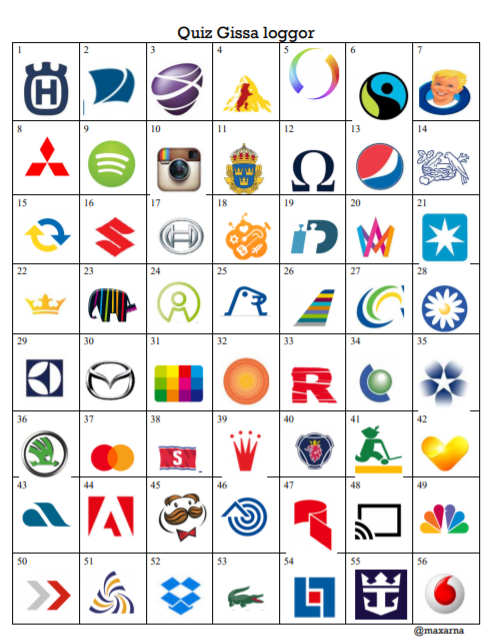
Where is `boxes in far left column`? The width and height of the screenshot is (493, 643). boxes in far left column is located at coordinates (47, 588), (51, 516), (53, 442), (40, 377), (40, 314), (43, 221), (40, 138), (43, 95).